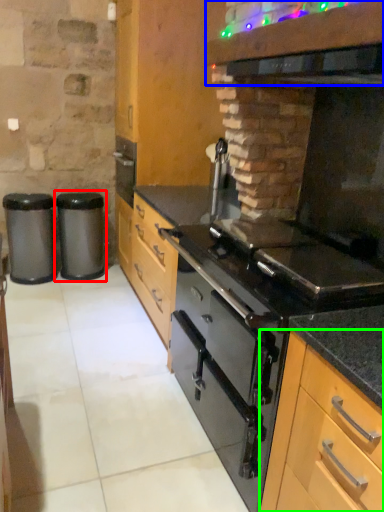
Question: Estimate the real-world distances between objects in this image. Which object is closer to waste container (highlighted by a red box), vent (highlighted by a blue box) or cabinetry (highlighted by a green box)?

Choices:
 (A) vent
 (B) cabinetry

Answer: (A)